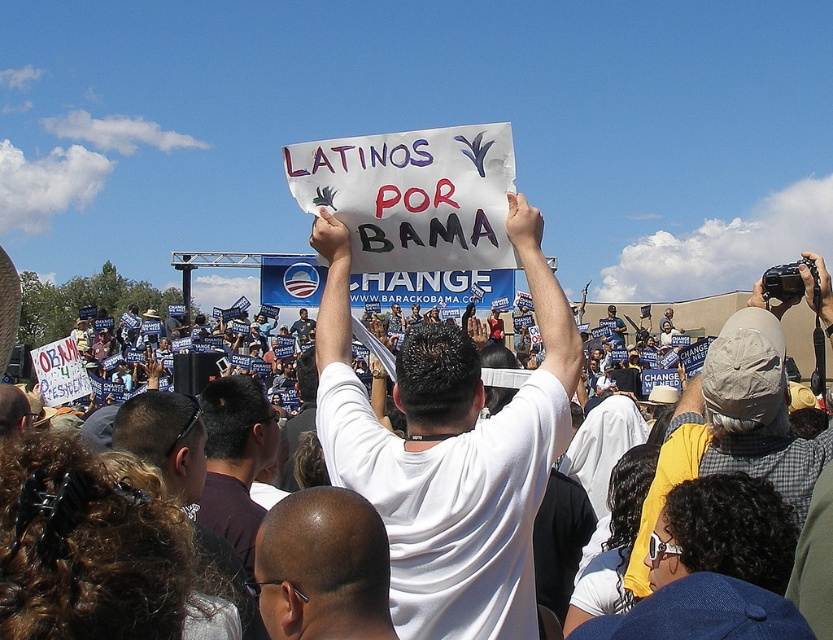
You are a photographer at the rally and want to capture a photo of the bald head at center and dark brown shirt at center. Which of the two should you focus on first if you want to ensure both are in the frame without needing to adjust your camera angle?

The bald head at center has a lesser height compared to dark brown shirt at center, so you should focus on the dark brown shirt at center first to ensure both are in the frame without needing to adjust your camera angle.

Consider the image. You are a photographer at the rally who wants to take a photo of the white matte shirt at center and the bald head at center. The minimum distance your camera can focus clearly is 25 feet. Will both subjects be in focus if they are 28.65 feet apart?

The white matte shirt at center is 28.65 feet from bald head at center. Since the minimum focus distance is 25 feet, the camera can focus on both subjects as they are beyond the minimum required distance.